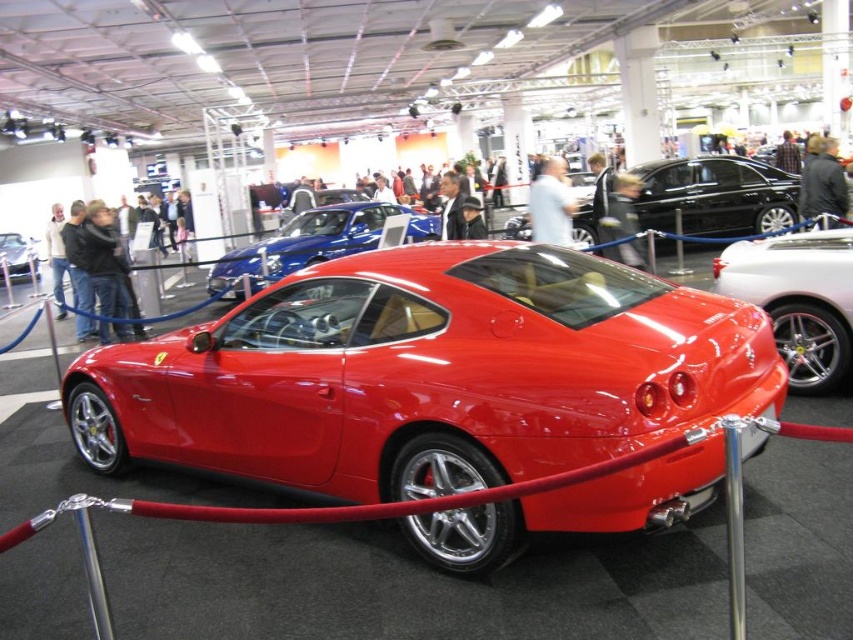
Can you confirm if shiny red car at center is positioned to the right of matte black car at center?

Yes, shiny red car at center is to the right of matte black car at center.

Does point (223, 288) come closer to viewer compared to point (28, 272)?

Yes.

Where is `shiny red car at center`? Image resolution: width=853 pixels, height=640 pixels. shiny red car at center is located at coordinates (312, 243).

Does glossy white car at right have a greater width compared to matte black car at center?

Incorrect, glossy white car at right's width does not surpass matte black car at center's.

Which is more to the left, glossy white car at right or matte black car at center?

From the viewer's perspective, matte black car at center appears more on the left side.

Does point (802, 253) lie behind point (32, 243)?

That is False.

The image size is (853, 640). What are the coordinates of `glossy white car at right` in the screenshot? It's located at (798, 300).

Locate an element on the screen. This screenshot has height=640, width=853. glossy black sedan at center is located at coordinates (715, 195).

Who is taller, glossy black sedan at center or matte black car at center?

Standing taller between the two is glossy black sedan at center.

Is point (721, 208) positioned in front of point (9, 250)?

Yes, point (721, 208) is closer to viewer.

Identify the location of glossy black sedan at center. click(715, 195).